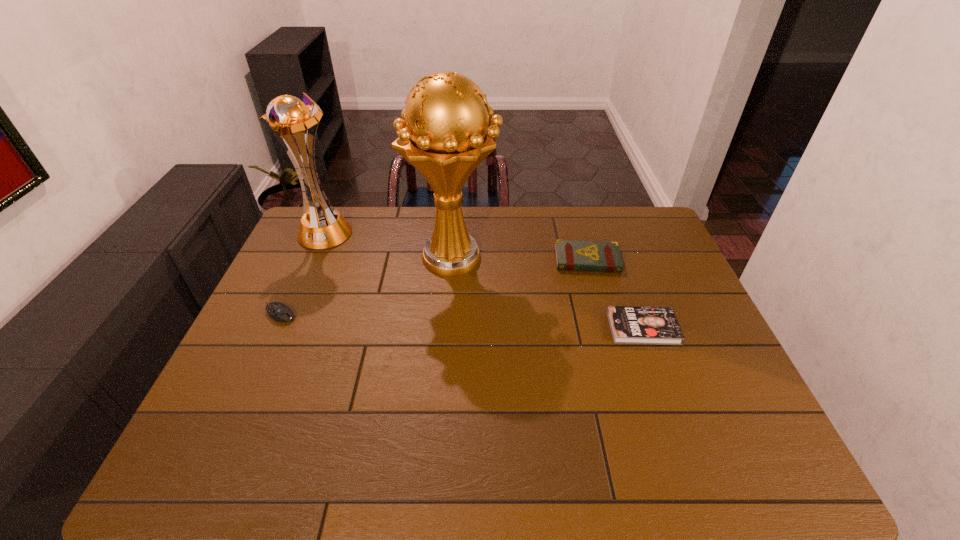
In order to click on free space located on the left of the farther book in this screenshot , I will do `click(505, 260)`.

The height and width of the screenshot is (540, 960). I want to click on free location located 0.060m on the right of the computer mouse, so click(x=319, y=314).

The image size is (960, 540). I want to click on vacant space located 0.090m on the right of the shortest object, so click(708, 328).

Image resolution: width=960 pixels, height=540 pixels. Find the location of `book present at the far edge`. book present at the far edge is located at coordinates (572, 255).

Where is `trophy at the left edge`? The image size is (960, 540). trophy at the left edge is located at coordinates (287, 117).

Locate an element on the screen. The width and height of the screenshot is (960, 540). computer mouse located at the left edge is located at coordinates (279, 312).

Where is `object that is at the right edge`? This screenshot has height=540, width=960. object that is at the right edge is located at coordinates (629, 324).

This screenshot has width=960, height=540. What are the coordinates of `object that is at the far left corner` in the screenshot? It's located at (287, 117).

Where is `blank space at the far edge of the desktop`? blank space at the far edge of the desktop is located at coordinates (508, 208).

Identify the location of free region at the near edge of the desktop. (486, 447).